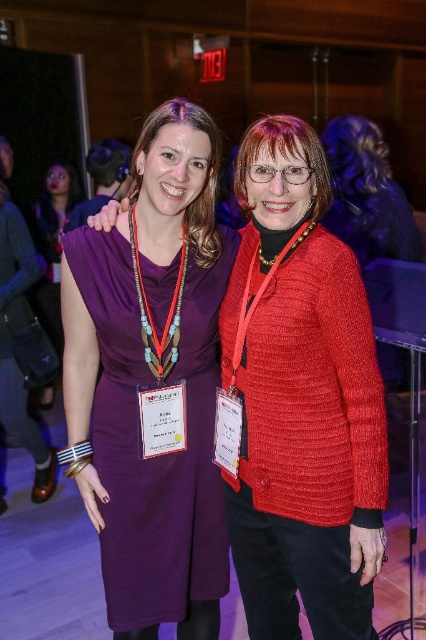
You are a photographer at a TEDx event. You need to capture a group photo that requires everyone to stand within 8 inches of each other. Given the current distance between the knitted red sweater at center and the matte purple dress at center, can they both fit within the required spacing?

The distance between the knitted red sweater at center and the matte purple dress at center is 9.06 inches, which exceeds the 8 inches requirement. Therefore, they need to move closer to meet the spacing requirement.

You are a photographer at a TEDx event. You need to adjust the lighting to ensure both the knitted red sweater at center and the matte purple dress at center are well lit. Since the sweater is below the dress, where should you position the light source to avoid shadows?

The knitted red sweater at center is located below the matte purple dress at center. Position the light source above both objects to cast light downward, ensuring both are illuminated without creating shadows between them.

You are standing in the room where the two women are posing. There is a point marked at coordinates (299, 401). What object is located at that point?

The point at coordinates (299, 401) marks the knitted red sweater at center.